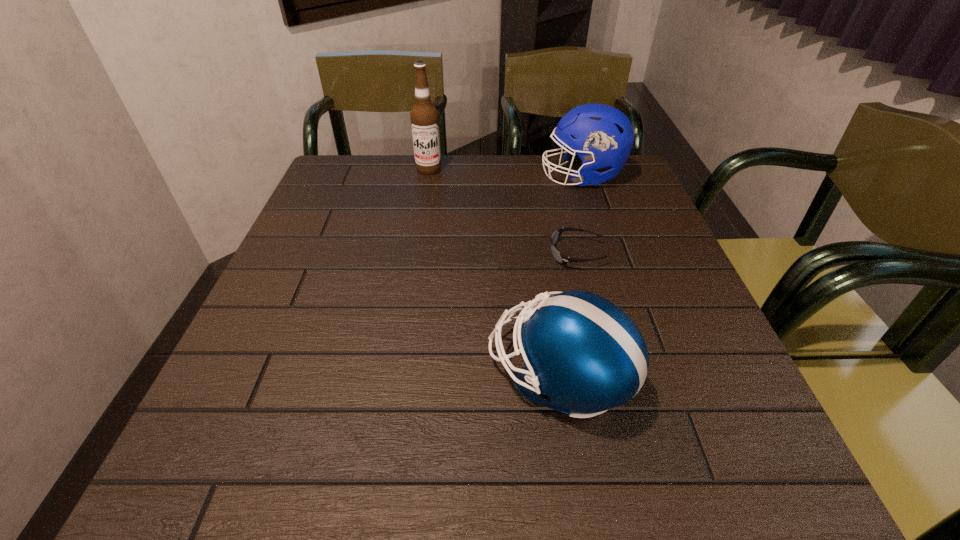
You are a GUI agent. You are given a task and a screenshot of the screen. Output one action in this format:
    pyautogui.click(x=<x>, y=<y>)
    Task: Click on the unoccupied area between the leftmost object and the nearest object
    
    Given the screenshot: What is the action you would take?
    [x=493, y=272]

In order to click on vacant space in between the farther football helmet and the third farthest object in this screenshot , I will do click(x=579, y=215).

Identify which object is the closest to the leftmost object. Please provide its 2D coordinates. Your answer should be formatted as a tuple, i.e. [(x, y)], where the tuple contains the x and y coordinates of a point satisfying the conditions above.

[(603, 136)]

The width and height of the screenshot is (960, 540). What are the coordinates of `object that stands as the closest to the sunglasses` in the screenshot? It's located at (583, 355).